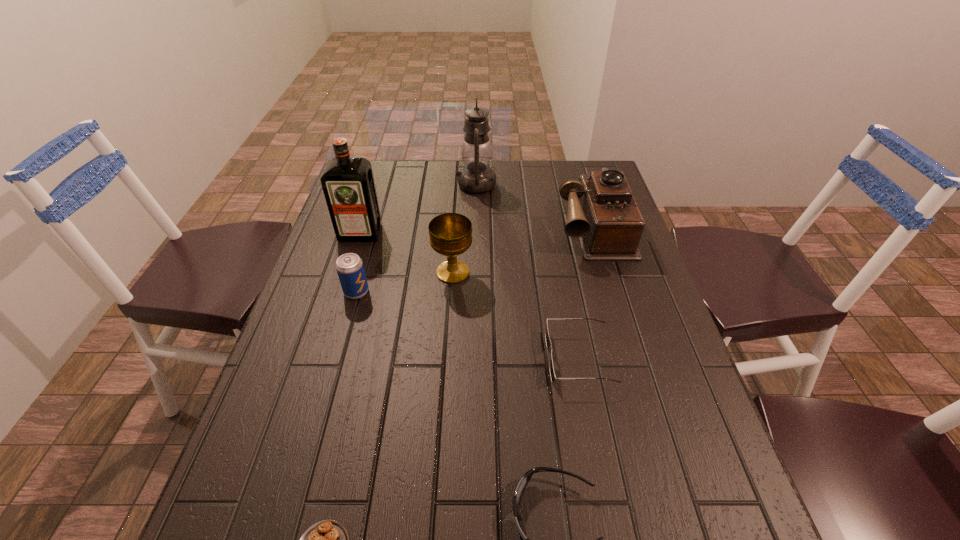
Find the location of a particular element. vacant space located on the front of the beer can is located at coordinates click(333, 375).

You are a GUI agent. You are given a task and a screenshot of the screen. Output one action in this format:
    pyautogui.click(x=<x>, y=<y>)
    Task: Click on the vacant space situated 0.320m on the front-facing side of the sixth farthest object
    This screenshot has width=960, height=540.
    Given the screenshot: What is the action you would take?
    pyautogui.click(x=405, y=358)

I want to click on vacant area situated 0.260m on the front-facing side of the sixth farthest object, so click(x=432, y=358).

This screenshot has height=540, width=960. Identify the location of free space located on the front-facing side of the sixth farthest object. (454, 358).

The image size is (960, 540). In order to click on object that is at the far edge in this screenshot , I will do `click(476, 177)`.

You are a GUI agent. You are given a task and a screenshot of the screen. Output one action in this format:
    pyautogui.click(x=<x>, y=<y>)
    Task: Click on the liquor present at the left edge
    The height and width of the screenshot is (540, 960).
    Given the screenshot: What is the action you would take?
    pyautogui.click(x=348, y=184)

This screenshot has height=540, width=960. What are the coordinates of `beer can at the left edge` in the screenshot? It's located at (349, 266).

Image resolution: width=960 pixels, height=540 pixels. I want to click on phonograph_record present at the right edge, so click(x=602, y=212).

The height and width of the screenshot is (540, 960). I want to click on sunglasses at the right edge, so click(548, 342).

The image size is (960, 540). Identify the location of vacant space at the far edge. (512, 170).